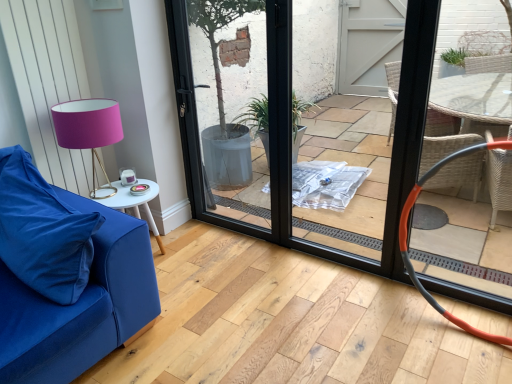
Question: From a real-world perspective, does black glass door at center sit lower than velvety blue pillow at lower left?

Choices:
 (A) yes
 (B) no

Answer: (B)

Question: Is the surface of black glass door at center in direct contact with velvety blue pillow at lower left?

Choices:
 (A) yes
 (B) no

Answer: (B)

Question: Is black glass door at center wider than velvety blue pillow at lower left?

Choices:
 (A) yes
 (B) no

Answer: (B)

Question: Does black glass door at center have a greater height compared to velvety blue pillow at lower left?

Choices:
 (A) yes
 (B) no

Answer: (A)

Question: Does black glass door at center have a lesser width compared to velvety blue pillow at lower left?

Choices:
 (A) no
 (B) yes

Answer: (B)

Question: Which is correct: black glass door at center is inside velvety blue pillow at lower left, or outside of it?

Choices:
 (A) outside
 (B) inside

Answer: (A)

Question: Is point (276, 152) closer or farther from the camera than point (70, 276)?

Choices:
 (A) closer
 (B) farther

Answer: (B)

Question: Based on their sizes in the image, would you say black glass door at center is bigger or smaller than velvety blue pillow at lower left?

Choices:
 (A) big
 (B) small

Answer: (A)

Question: From the image's perspective, is black glass door at center positioned above or below velvety blue pillow at lower left?

Choices:
 (A) above
 (B) below

Answer: (A)

Question: In the image, is velvety blue pillow at lower left on the left side or the right side of matte gold table lamp at left?

Choices:
 (A) right
 (B) left

Answer: (B)

Question: In terms of height, does velvety blue pillow at lower left look taller or shorter compared to matte gold table lamp at left?

Choices:
 (A) short
 (B) tall

Answer: (A)

Question: Is velvety blue pillow at lower left bigger or smaller than matte gold table lamp at left?

Choices:
 (A) small
 (B) big

Answer: (B)

Question: Considering their positions, is velvety blue pillow at lower left located in front of or behind matte gold table lamp at left?

Choices:
 (A) behind
 (B) front

Answer: (B)

Question: Based on their sizes in the image, would you say black glass door at center is bigger or smaller than matte gold table lamp at left?

Choices:
 (A) small
 (B) big

Answer: (B)

Question: Is black glass door at center to the left or to the right of matte gold table lamp at left in the image?

Choices:
 (A) right
 (B) left

Answer: (A)